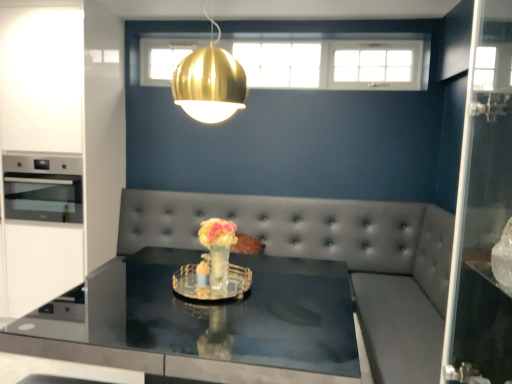
Question: In terms of size, does translucent glass vase at center appear bigger or smaller than gold metallic pendant light at upper center?

Choices:
 (A) big
 (B) small

Answer: (B)

Question: Is translucent glass vase at center taller or shorter than gold metallic pendant light at upper center?

Choices:
 (A) short
 (B) tall

Answer: (A)

Question: Which of these objects is positioned closest to the gold metallic pendant light at upper center?

Choices:
 (A) white glossy cabinetry at left
 (B) shiny black glass table at center
 (C) stainless steel oven at left
 (D) translucent glass vase at center

Answer: (D)

Question: Which object is positioned closest to the stainless steel oven at left?

Choices:
 (A) white glossy cabinetry at left
 (B) gold metallic pendant light at upper center
 (C) translucent glass vase at center
 (D) shiny black glass table at center

Answer: (A)